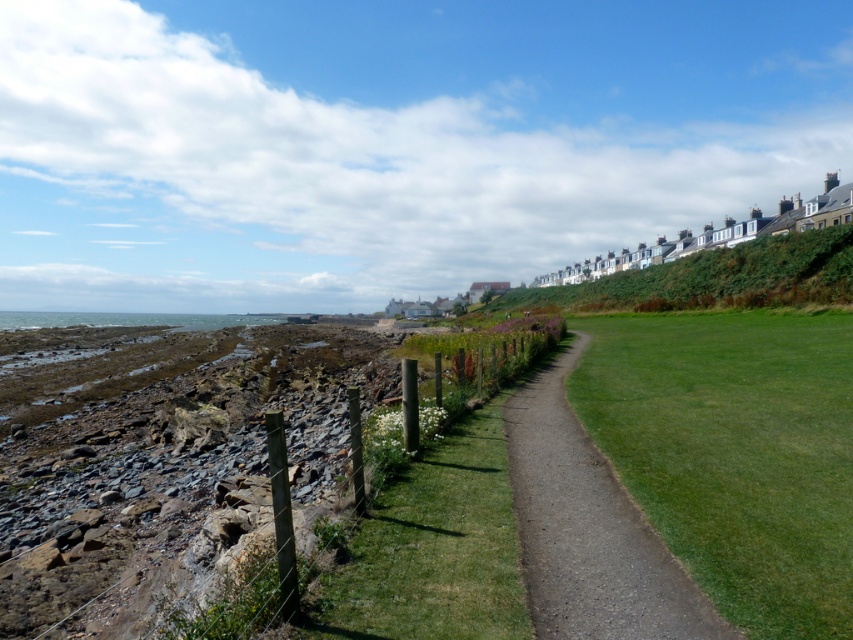
Question: Is dirt/gravel path at center positioned at the back of wooden post fence at lower left?

Choices:
 (A) no
 (B) yes

Answer: (A)

Question: Which of the following is the farthest from the observer?

Choices:
 (A) green smooth lawn at center-right
 (B) dirt/gravel path at center

Answer: (A)

Question: Does dirt/gravel path at center appear on the right side of wooden post fence at lower left?

Choices:
 (A) no
 (B) yes

Answer: (B)

Question: Which point is farther to the camera?

Choices:
 (A) green smooth lawn at center-right
 (B) dirt/gravel path at center

Answer: (A)

Question: Which of the following is the farthest from the observer?

Choices:
 (A) wooden post fence at lower left
 (B) green smooth lawn at center-right

Answer: (A)

Question: Is green smooth lawn at center-right smaller than dirt/gravel path at center?

Choices:
 (A) yes
 (B) no

Answer: (B)